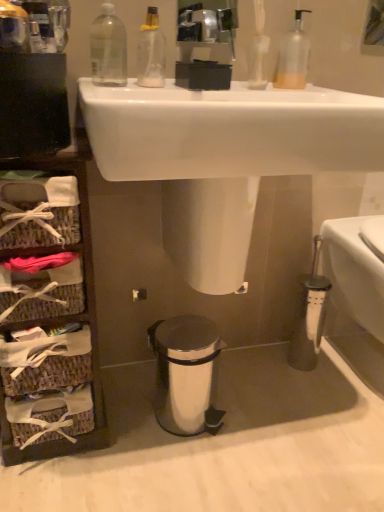
Locate an element on the screen. vacant region to the left of silver metallic trash can at lower center is located at coordinates (124, 409).